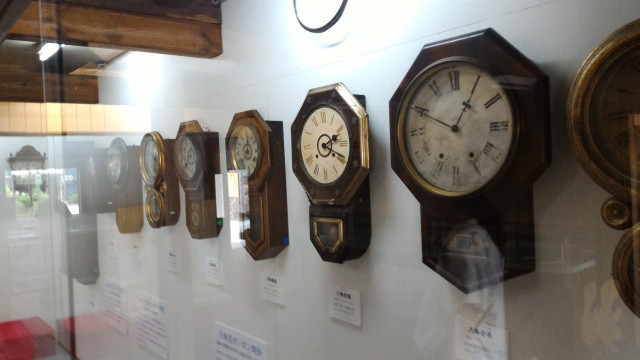
Identify the location of ceiling beam. The height and width of the screenshot is (360, 640). (136, 28), (76, 94).